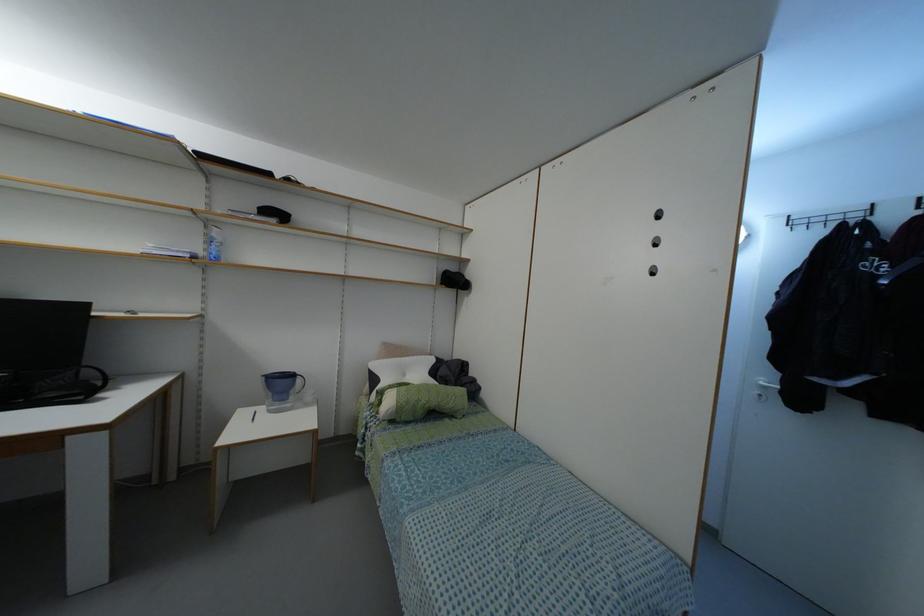
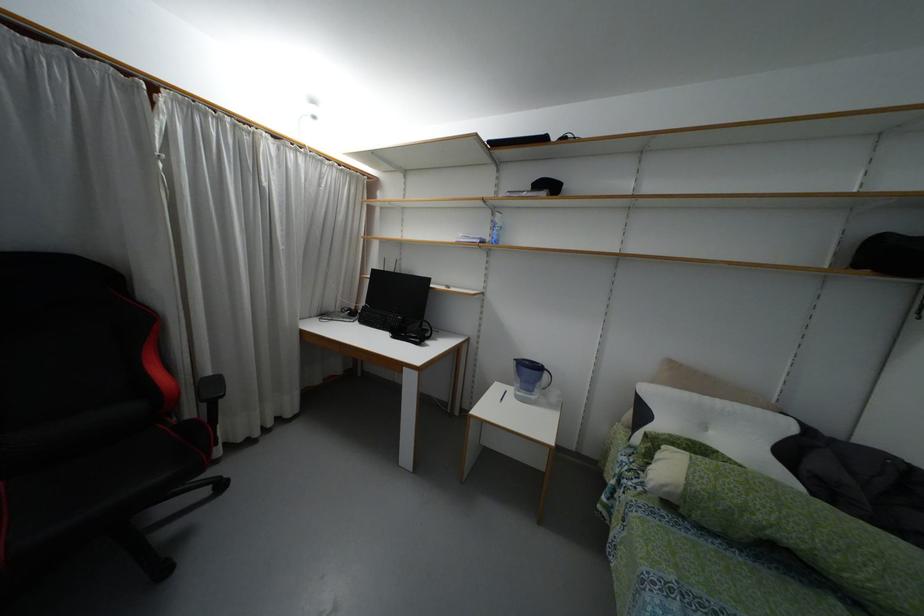
In the second image, find the point that corresponds to pixel 298 379 in the first image.

(544, 375)